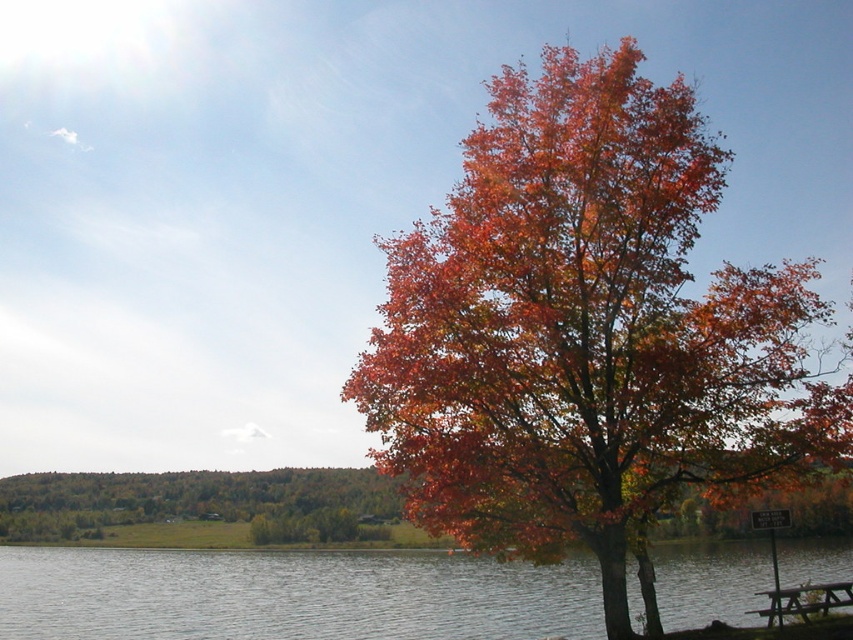
You are an artist trying to sketch the scene. You notice the shiny orange leaves at center and the orange leafy tree at center. Which one is located to the right of the other?

The shiny orange leaves at center is positioned on the right side of orange leafy tree at center.

Consider the image. You are planning to have a picnic and see the clear water at lower center and the wooden picnic table at lower right in the scene. Which object is closer to the bottom edge of the image?

The wooden picnic table at lower right is closer to the bottom edge of the image because the clear water at lower center is below it.

You are standing at the center of the lakeside scene. There is a shiny orange leaf at point (585, 332). Can you tell me the exact coordinates of the shiny orange leaf?

The shiny orange leaves at center is located at point (585, 332).